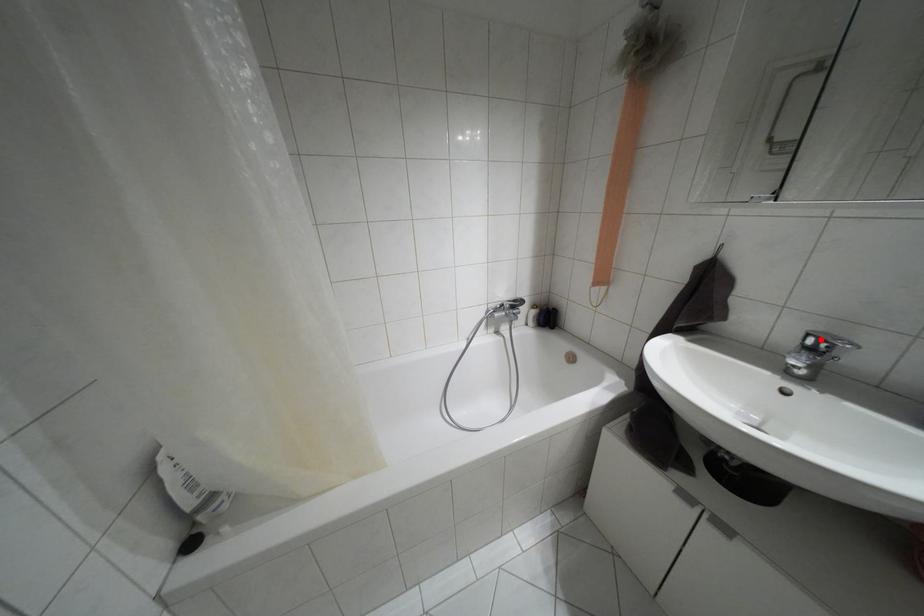
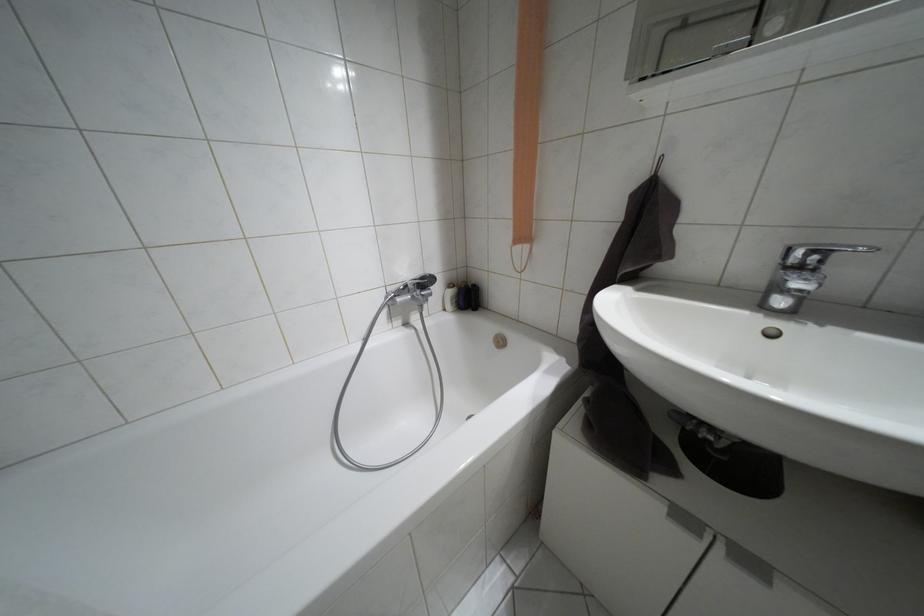
Locate, in the second image, the point that corresponds to the highlighted location in the first image.

(810, 253)